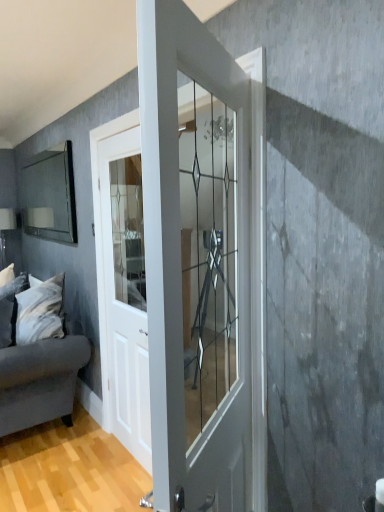
Question: Is velvet gray couch at left at the left side of clear glass door at center, which appears as the second door when viewed from the back?

Choices:
 (A) no
 (B) yes

Answer: (B)

Question: Is velvet gray couch at left facing towards clear glass door at center, positioned as the first door in right-to-left order?

Choices:
 (A) yes
 (B) no

Answer: (B)

Question: From the image's perspective, is velvet gray couch at left over clear glass door at center, positioned as the first door in right-to-left order?

Choices:
 (A) no
 (B) yes

Answer: (A)

Question: Considering the relative sizes of velvet gray couch at left and clear glass door at center, which ranks as the 1th door in front-to-back order, in the image provided, is velvet gray couch at left taller than clear glass door at center, which ranks as the 1th door in front-to-back order,?

Choices:
 (A) no
 (B) yes

Answer: (A)

Question: Is velvet gray couch at left touching clear glass door at center, which ranks as the 1th door in front-to-back order?

Choices:
 (A) yes
 (B) no

Answer: (B)

Question: From a real-world perspective, is velvet gray couch at left under clear glass door at center, arranged as the second door when viewed from the left?

Choices:
 (A) no
 (B) yes

Answer: (B)

Question: Is white soft pillow at left positioned far away from matte glass mirror at left?

Choices:
 (A) no
 (B) yes

Answer: (A)

Question: Considering the relative sizes of white soft pillow at left and matte glass mirror at left in the image provided, is white soft pillow at left wider than matte glass mirror at left?

Choices:
 (A) no
 (B) yes

Answer: (B)

Question: Is white soft pillow at left to the right of matte glass mirror at left from the viewer's perspective?

Choices:
 (A) yes
 (B) no

Answer: (A)

Question: Does white soft pillow at left have a lesser width compared to matte glass mirror at left?

Choices:
 (A) yes
 (B) no

Answer: (B)

Question: From a real-world perspective, is white soft pillow at left located beneath matte glass mirror at left?

Choices:
 (A) no
 (B) yes

Answer: (B)

Question: Is white soft pillow at left facing away from matte glass mirror at left?

Choices:
 (A) no
 (B) yes

Answer: (A)

Question: From the image's perspective, is white soft pillow at left under velvet gray couch at left?

Choices:
 (A) yes
 (B) no

Answer: (B)